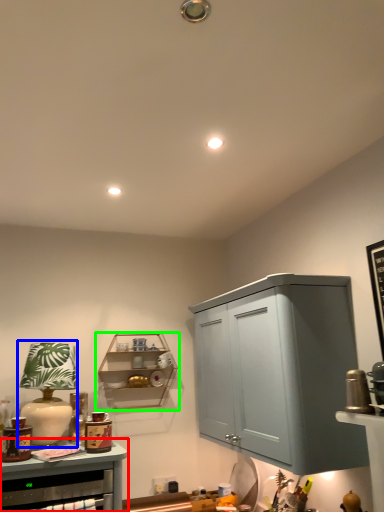
Question: Which object is the closest to the cabinetry (highlighted by a red box)? Choose among these: table lamp (highlighted by a blue box) or shelf (highlighted by a green box).

Choices:
 (A) table lamp
 (B) shelf

Answer: (A)